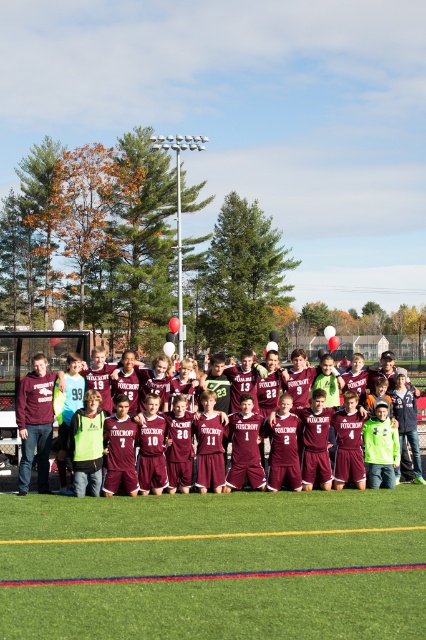
Who is positioned more to the left, green artificial turf at center or maroon jersey at center?

maroon jersey at center is more to the left.

Can you confirm if green artificial turf at center is positioned above maroon jersey at center?

No.

Where is `green artificial turf at center`? green artificial turf at center is located at coordinates (210, 532).

Where is `green artificial turf at center`? The width and height of the screenshot is (426, 640). green artificial turf at center is located at coordinates (210, 532).